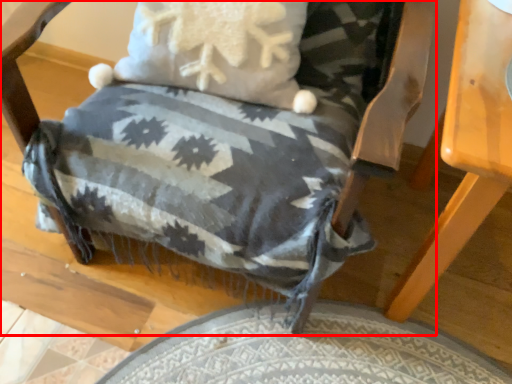
Question: From the image's perspective, what is the correct spatial positioning of chair (annotated by the red box) in reference to table?

Choices:
 (A) above
 (B) below

Answer: (A)